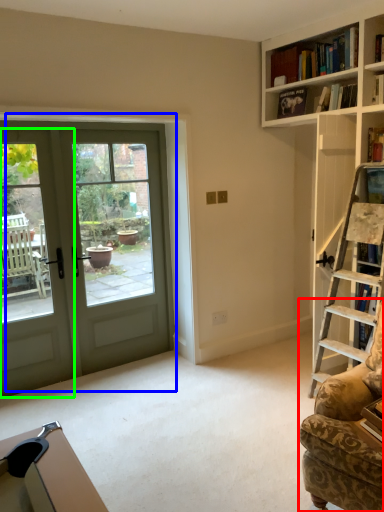
Question: Which object is positioned farthest from rocking chair (highlighted by a red box)? Select from door (highlighted by a blue box) and screen door (highlighted by a green box).

Choices:
 (A) door
 (B) screen door

Answer: (B)